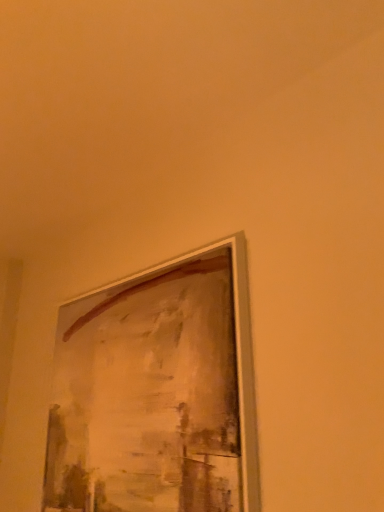
This screenshot has width=384, height=512. What do you see at coordinates (157, 392) in the screenshot?
I see `wooden frame at upper center` at bounding box center [157, 392].

Image resolution: width=384 pixels, height=512 pixels. What are the coordinates of `wooden frame at upper center` in the screenshot? It's located at (157, 392).

Where is `wooden frame at upper center`? The height and width of the screenshot is (512, 384). wooden frame at upper center is located at coordinates (157, 392).